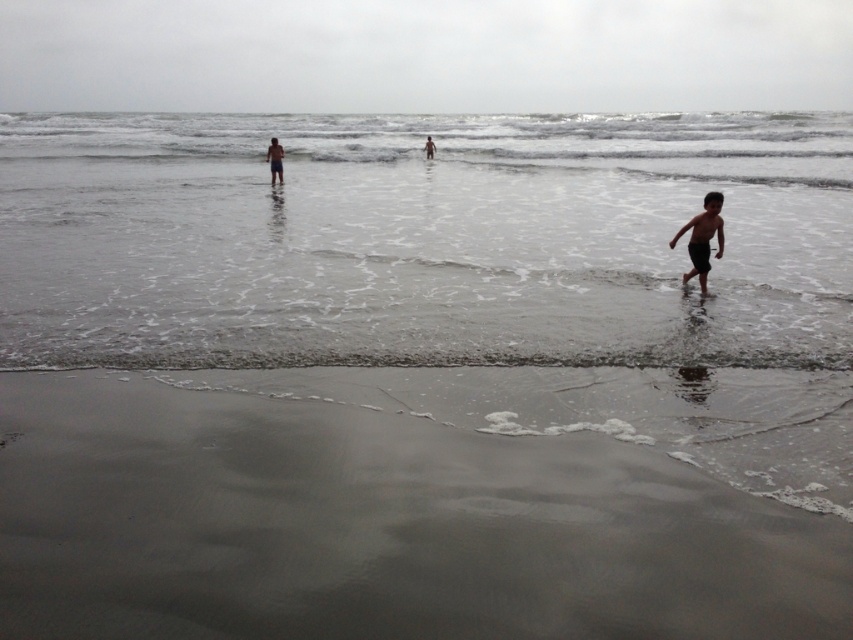
Question: Considering the real-world distances, which object is farthest from the clear water at center?

Choices:
 (A) smooth skin human at center
 (B) dark skin human at center

Answer: (A)

Question: Which point is farther to the camera?

Choices:
 (A) clear water at center
 (B) dark skin human at center
 (C) smooth skin human at center

Answer: (B)

Question: Which of the following is the closest to the observer?

Choices:
 (A) dark skin human at center
 (B) sandy beach at lower left
 (C) smooth skin human at center
 (D) clear water at center

Answer: (B)

Question: Considering the relative positions of clear water at center and smooth skin human at center in the image provided, where is clear water at center located with respect to smooth skin human at center?

Choices:
 (A) below
 (B) above

Answer: (B)

Question: Does sandy beach at lower left have a greater width compared to dark skin human at center?

Choices:
 (A) no
 (B) yes

Answer: (B)

Question: Is sandy beach at lower left in front of black matte shorts at lower right?

Choices:
 (A) yes
 (B) no

Answer: (A)